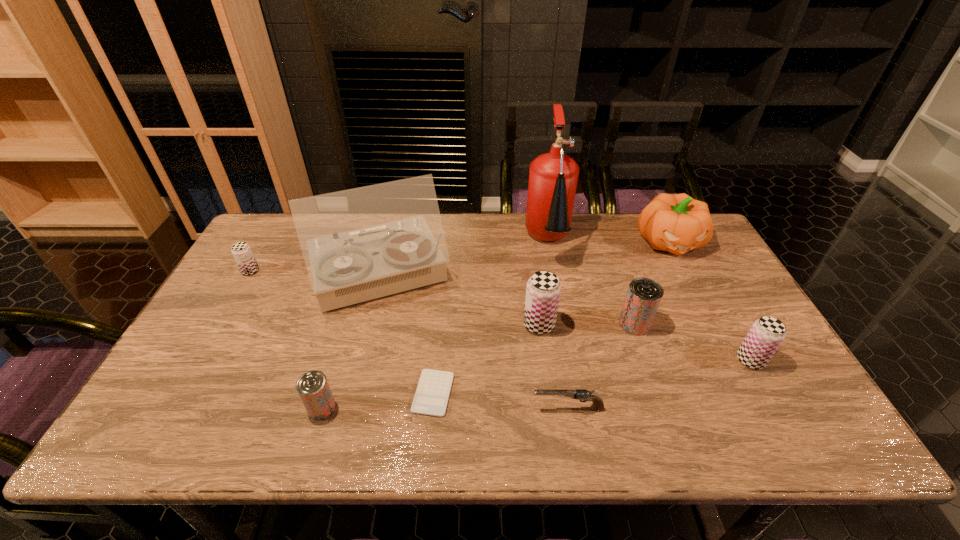
Locate an element on the screen. Image resolution: width=960 pixels, height=540 pixels. the tallest object is located at coordinates (553, 176).

Find the location of a particular element. Image resolution: width=960 pixels, height=540 pixels. red fire extinguisher is located at coordinates (553, 176).

Identify the location of record player. (364, 243).

You are a GUI agent. You are given a task and a screenshot of the screen. Output one action in this format:
    pyautogui.click(x=<x>, y=<y>)
    Task: Click on the ninth shortest object
    This screenshot has width=960, height=540.
    Given the screenshot: What is the action you would take?
    pyautogui.click(x=364, y=243)

Find the location of `pumpkin`. pumpkin is located at coordinates (677, 223).

Locate an element on the screen. This screenshot has height=540, width=960. the second purple beer can from left to right is located at coordinates tap(543, 290).

Where is `the third beer can from right to left`? The height and width of the screenshot is (540, 960). the third beer can from right to left is located at coordinates 543,290.

I want to click on the rightmost beer can, so click(765, 336).

At what (x,y) coordinates should I click in order to perform the action: click on the second nearest beer can. Please return your answer as a coordinate pair (x, y). Image resolution: width=960 pixels, height=540 pixels. Looking at the image, I should click on (765, 336).

Find the location of a particular element. This screenshot has height=540, width=960. the right red beer can is located at coordinates (644, 295).